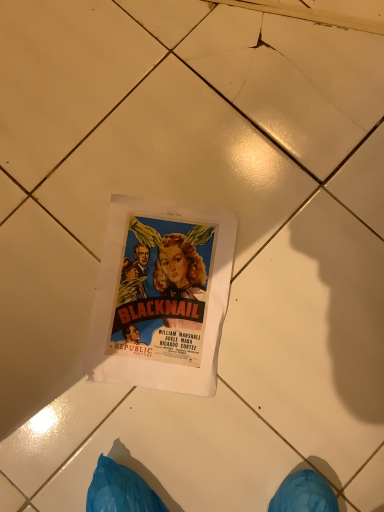
Describe the element at coordinates (161, 296) in the screenshot. The image size is (384, 512). I see `matte paper poster at center` at that location.

Find the location of a particular element. The width and height of the screenshot is (384, 512). matte paper poster at center is located at coordinates (161, 296).

You are a GUI agent. You are given a task and a screenshot of the screen. Output one action in this format:
    pyautogui.click(x=<x>, y=<y>)
    Task: Click on the matte paper poster at center
    The image size is (384, 512).
    Given the screenshot: What is the action you would take?
    pyautogui.click(x=161, y=296)